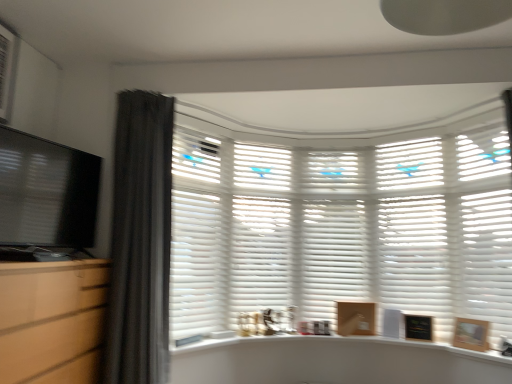
This screenshot has width=512, height=384. What are the coordinates of `vacant space to the left of wooden picture frame at lower right, the 2th picture frame from the back` in the screenshot? It's located at (455, 347).